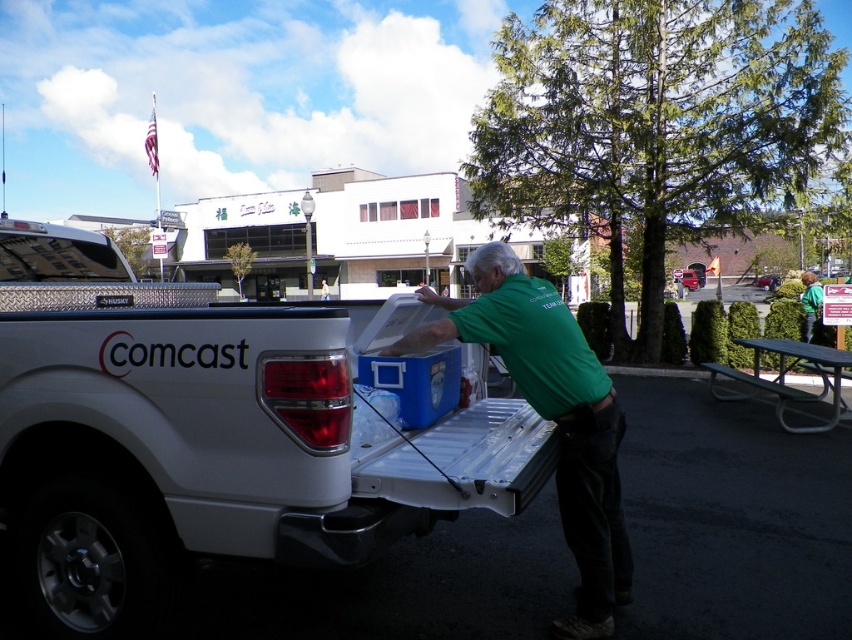
You are standing 10 feet away from the blue plastic cooler at center. Can you reach it without moving closer?

The blue plastic cooler at center is only 9.74 feet away from the viewer, so you can reach it without moving closer because you are already within that distance.

Based on the scene described, which object is bigger between the green fabric shirt at center and the metallic gray picnic table at right?

The green fabric shirt at center has a larger size compared to the metallic gray picnic table at right, so the green fabric shirt at center is bigger.